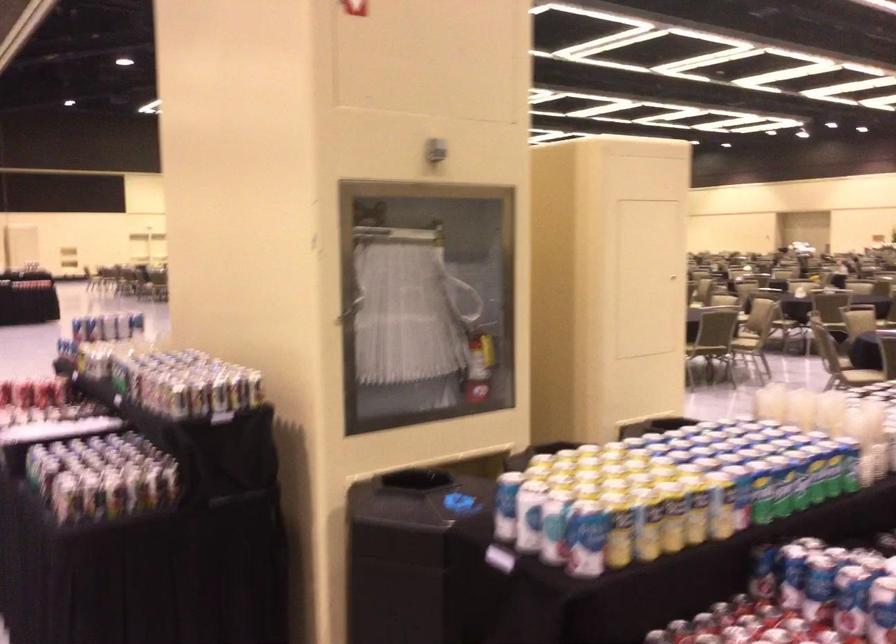
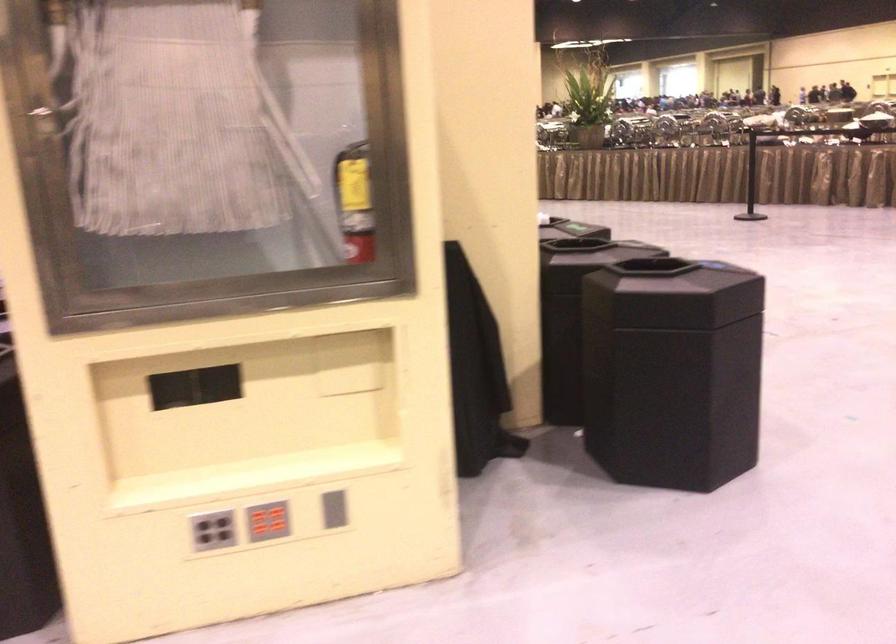
Question: I am providing you with two images of the same scene from different viewpoints. After the viewpoint changes to image2, which objects are now occluded?

Choices:
 (A) red fire extinguisher
 (B) grey button panel
 (C) red button panel
 (D) white closed laptop

Answer: (A)